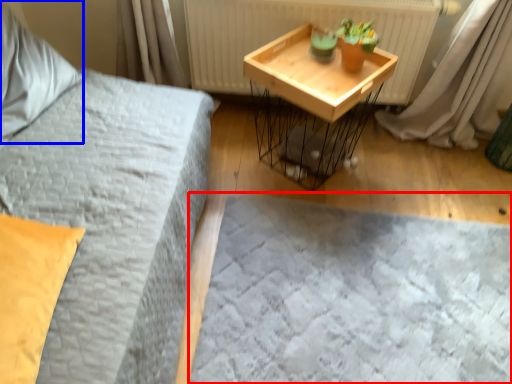
Question: Which object appears closest to the camera in this image, bed frame (highlighted by a red box) or pillow (highlighted by a blue box)?

Choices:
 (A) bed frame
 (B) pillow

Answer: (B)